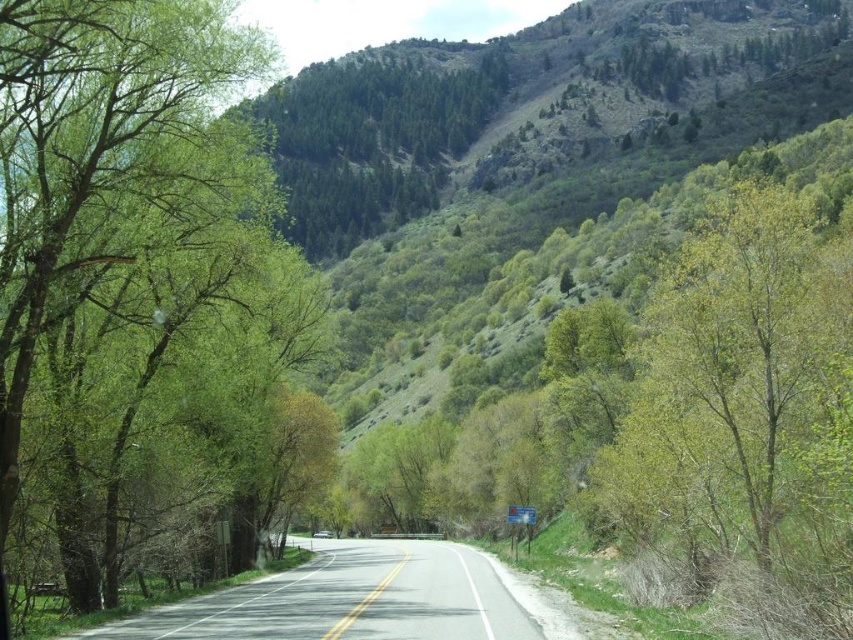
Can you confirm if green leafy tree at left is positioned below gray asphalt road at center?

Actually, green leafy tree at left is above gray asphalt road at center.

You are a GUI agent. You are given a task and a screenshot of the screen. Output one action in this format:
    pyautogui.click(x=<x>, y=<y>)
    Task: Click on the green leafy tree at left
    The width and height of the screenshot is (853, 640).
    Given the screenshot: What is the action you would take?
    pyautogui.click(x=126, y=243)